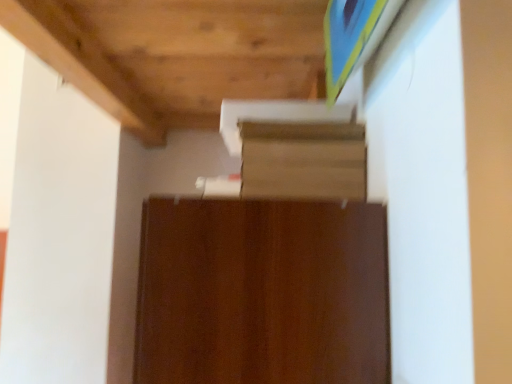
Question: Should I look upward or downward to see brown wood cabinet at center?

Choices:
 (A) up
 (B) down

Answer: (B)

Question: From the image's perspective, does wooden shelf at upper center appear lower than brown wood cabinet at center?

Choices:
 (A) yes
 (B) no

Answer: (B)

Question: Considering the relative sizes of wooden shelf at upper center and brown wood cabinet at center in the image provided, is wooden shelf at upper center wider than brown wood cabinet at center?

Choices:
 (A) no
 (B) yes

Answer: (A)

Question: Is wooden shelf at upper center shorter than brown wood cabinet at center?

Choices:
 (A) yes
 (B) no

Answer: (A)

Question: Is wooden shelf at upper center with brown wood cabinet at center?

Choices:
 (A) yes
 (B) no

Answer: (B)

Question: Could you tell me if wooden shelf at upper center is facing brown wood cabinet at center?

Choices:
 (A) no
 (B) yes

Answer: (A)

Question: Considering the relative positions of wooden shelf at upper center and brown wood cabinet at center in the image provided, is wooden shelf at upper center to the left of brown wood cabinet at center from the viewer's perspective?

Choices:
 (A) no
 (B) yes

Answer: (A)

Question: From the image's perspective, is brown wood cabinet at center above wooden shelf at upper center?

Choices:
 (A) no
 (B) yes

Answer: (A)

Question: Considering the relative sizes of brown wood cabinet at center and wooden shelf at upper center in the image provided, is brown wood cabinet at center thinner than wooden shelf at upper center?

Choices:
 (A) yes
 (B) no

Answer: (B)

Question: Is wooden shelf at upper center surrounded by brown wood cabinet at center?

Choices:
 (A) yes
 (B) no

Answer: (B)

Question: From a real-world perspective, is brown wood cabinet at center beneath wooden shelf at upper center?

Choices:
 (A) no
 (B) yes

Answer: (B)

Question: Does brown wood cabinet at center have a smaller size compared to wooden shelf at upper center?

Choices:
 (A) yes
 (B) no

Answer: (B)

Question: Does brown wood cabinet at center lie in front of wooden shelf at upper center?

Choices:
 (A) yes
 (B) no

Answer: (A)

Question: Relative to wooden shelf at upper center, is brown wood cabinet at center in front or behind?

Choices:
 (A) front
 (B) behind

Answer: (A)